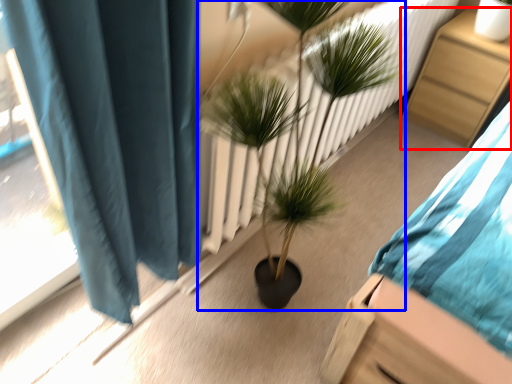
Question: Which of the following is the closest to the observer, furniture (highlighted by a red box) or houseplant (highlighted by a blue box)?

Choices:
 (A) furniture
 (B) houseplant

Answer: (B)